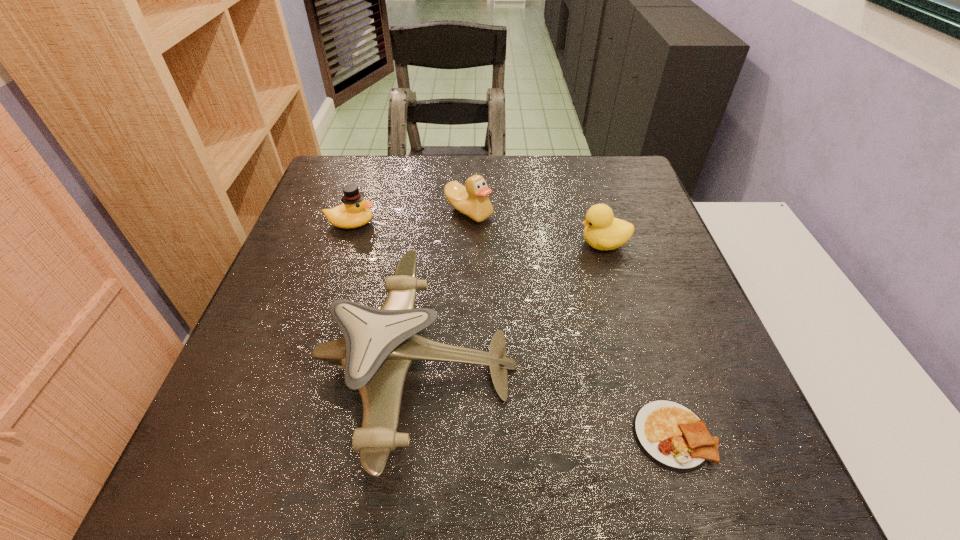
You are a GUI agent. You are given a task and a screenshot of the screen. Output one action in this format:
    pyautogui.click(x=<x>, y=<y>)
    Task: Click on the second duck from left to right
    
    Given the screenshot: What is the action you would take?
    pyautogui.click(x=472, y=200)

Locate an element on the screen. The image size is (960, 540). the rightmost duck is located at coordinates tap(602, 231).

This screenshot has width=960, height=540. What are the coordinates of `the leftmost duck` in the screenshot? It's located at point(355,212).

Where is `drone`? The width and height of the screenshot is (960, 540). drone is located at coordinates (378, 346).

Find the location of a particular element. The height and width of the screenshot is (540, 960). omelet is located at coordinates (671, 435).

The image size is (960, 540). Identify the location of free space located 0.120m at the beak of the second duck from right to left. (468, 260).

This screenshot has width=960, height=540. What are the coordinates of `free space located 0.400m on the front-facing side of the rightmost duck` in the screenshot? It's located at (411, 244).

Where is `blank space located 0.170m on the front-facing side of the rightmost duck`? blank space located 0.170m on the front-facing side of the rightmost duck is located at coordinates (507, 244).

Locate an element on the screen. This screenshot has width=960, height=540. blank area located 0.110m on the front-facing side of the rightmost duck is located at coordinates (532, 244).

Locate an element on the screen. Image resolution: width=960 pixels, height=540 pixels. free region located 0.340m on the front-facing side of the leftmost duck is located at coordinates (512, 223).